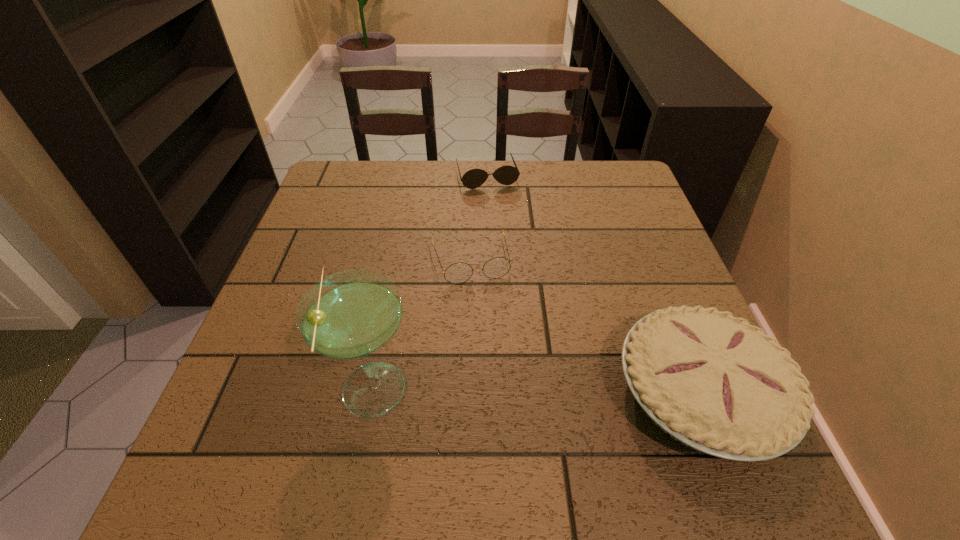
I want to click on blank space located 0.050m on the front-facing side of the sunglasses, so click(495, 200).

Find the location of a particular element. free space located 0.100m on the front-facing side of the sunglasses is located at coordinates (498, 211).

Identify the location of vacant space located on the front-facing side of the sunglasses. (517, 273).

The width and height of the screenshot is (960, 540). In order to click on object at the far edge in this screenshot , I will do `click(506, 175)`.

Identify the location of martini situated at the near edge. Image resolution: width=960 pixels, height=540 pixels. (350, 315).

Image resolution: width=960 pixels, height=540 pixels. What are the coordinates of `pie situated at the near edge` in the screenshot? It's located at (717, 384).

You are a GUI agent. You are given a task and a screenshot of the screen. Output one action in this format:
    pyautogui.click(x=<x>, y=<y>)
    Task: Click on the object located in the right edge section of the desktop
    Image resolution: width=960 pixels, height=540 pixels.
    Given the screenshot: What is the action you would take?
    pyautogui.click(x=717, y=384)

Find the location of a particular element. object situated at the near right corner is located at coordinates (717, 384).

The width and height of the screenshot is (960, 540). In order to click on vacant space at the far edge in this screenshot , I will do `click(540, 192)`.

Identify the location of blank space at the near edge of the desktop. Image resolution: width=960 pixels, height=540 pixels. (526, 435).